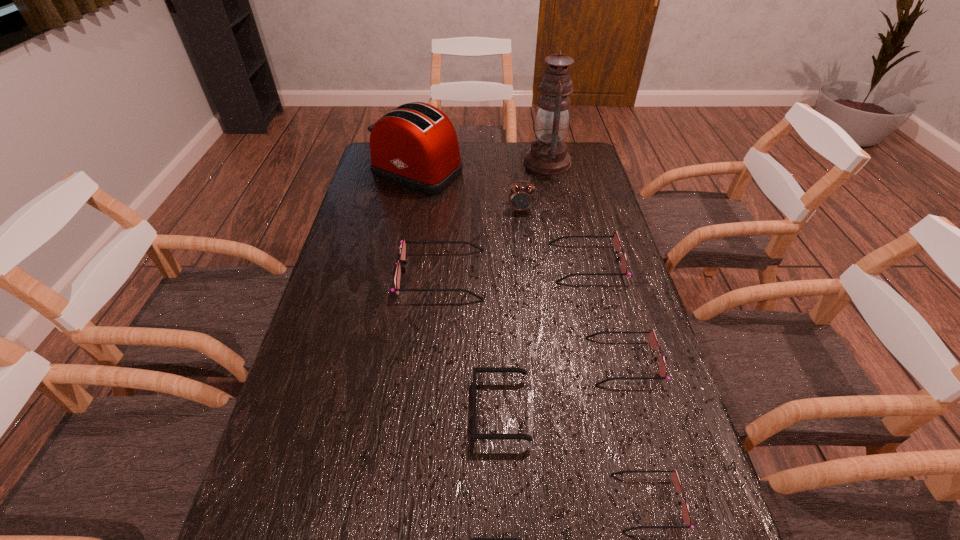
I want to click on oil lamp that is at the far edge, so click(x=548, y=155).

Locate an element on the screen. Image resolution: width=960 pixels, height=540 pixels. toaster situated at the far edge is located at coordinates (415, 145).

Locate an element on the screen. The height and width of the screenshot is (540, 960). object that is at the left edge is located at coordinates (415, 145).

Find the location of `oil lamp located at the right edge`. oil lamp located at the right edge is located at coordinates (548, 155).

I want to click on object present at the far left corner, so click(415, 145).

Find the location of a particular element. object present at the far right corner is located at coordinates (548, 155).

What are the coordinates of `vacant space at the far edge` in the screenshot? It's located at (502, 147).

In the image, there is a desktop. At what (x,y) coordinates should I click in order to perform the action: click on free space at the left edge. Please return your answer as a coordinate pair (x, y). Looking at the image, I should click on (356, 248).

The height and width of the screenshot is (540, 960). Identify the location of vacant space at the right edge. (586, 262).

The height and width of the screenshot is (540, 960). In order to click on vacant space at the far right corner of the desktop in this screenshot , I will do `click(578, 149)`.